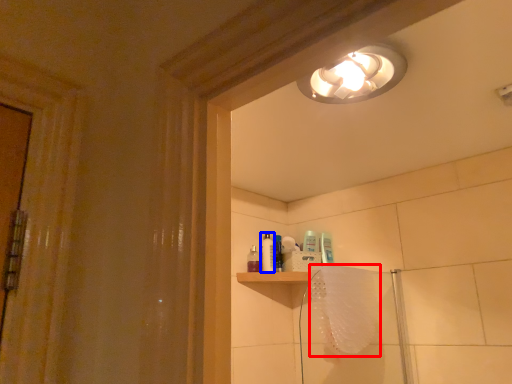
Question: Which point is further to the camera, bath towel (highlighted by a red box) or toiletry (highlighted by a blue box)?

Choices:
 (A) bath towel
 (B) toiletry

Answer: (B)